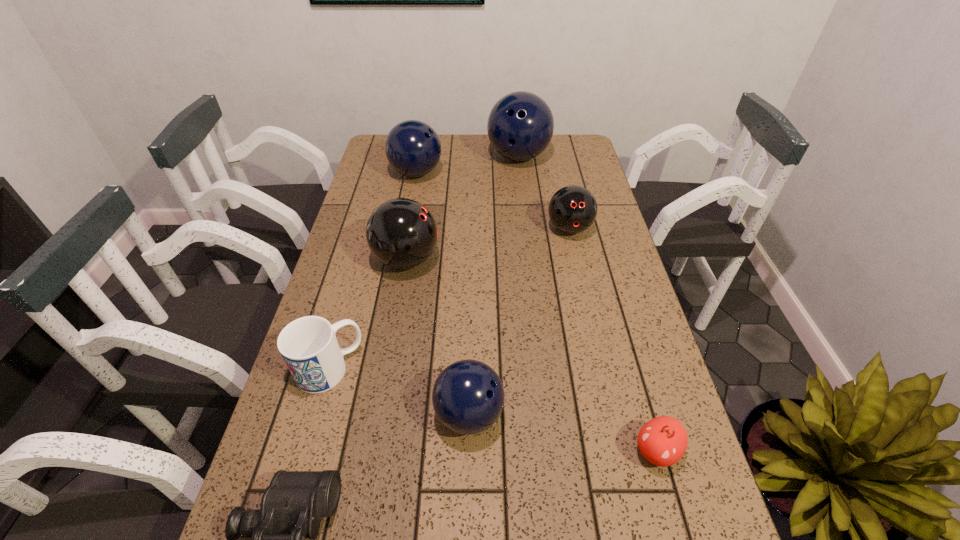
Find the location of a particular element. This screenshot has width=960, height=540. vacant space located 0.140m on the surface of the second smallest blue bowling ball near the finger holes is located at coordinates (482, 173).

At what (x,y) coordinates should I click in order to perform the action: click on vacant space situated 0.290m on the surface of the bigger black bowling ball near the finger holes. Please return your answer as a coordinate pair (x, y). Looking at the image, I should click on (541, 260).

Where is `free region located 0.200m on the surface of the smaller black bowling ball near the finger holes`? Image resolution: width=960 pixels, height=540 pixels. free region located 0.200m on the surface of the smaller black bowling ball near the finger holes is located at coordinates (584, 293).

Locate an element on the screen. The height and width of the screenshot is (540, 960). vacant space located 0.300m on the surface of the nearest bowling ball near the finger holes is located at coordinates (646, 414).

Locate an element on the screen. The height and width of the screenshot is (540, 960). free space located on the front of the mug is located at coordinates (301, 468).

Where is `vacant region located 0.230m on the left of the apple`? This screenshot has height=540, width=960. vacant region located 0.230m on the left of the apple is located at coordinates (516, 451).

The image size is (960, 540). I want to click on mug that is at the left edge, so click(x=308, y=345).

Find the location of a particular element. This screenshot has width=960, height=540. apple that is at the right edge is located at coordinates (662, 441).

I want to click on object that is positioned at the far left corner, so click(x=413, y=148).

Where is `object present at the far right corner`? The height and width of the screenshot is (540, 960). object present at the far right corner is located at coordinates (520, 126).